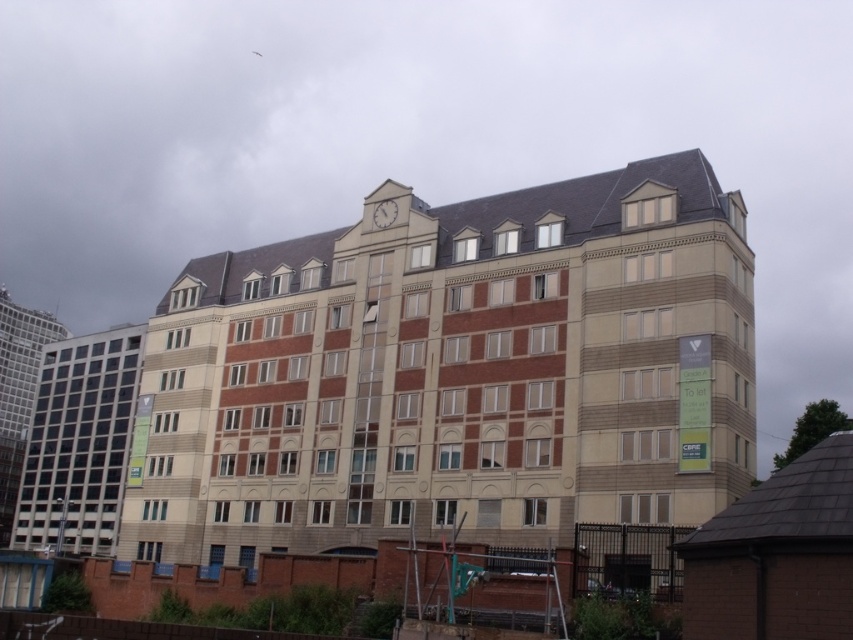
Is beige brick building at center in front of white stone clock at upper center?

Yes, beige brick building at center is in front of white stone clock at upper center.

Does point (704, 276) lie behind point (381, 227)?

No, it is not.

The width and height of the screenshot is (853, 640). Identify the location of beige brick building at center. (456, 372).

The height and width of the screenshot is (640, 853). Identify the location of beige brick building at center. (456, 372).

Does beige brick building at center have a larger size compared to matte glass building at left?

Indeed, beige brick building at center has a larger size compared to matte glass building at left.

Is point (323, 429) behind point (102, 476)?

No, (323, 429) is in front of (102, 476).

Is point (648, 438) positioned in front of point (94, 492)?

Yes, point (648, 438) is closer to viewer.

At what (x,y) coordinates should I click in order to perform the action: click on beige brick building at center. Please return your answer as a coordinate pair (x, y). Looking at the image, I should click on (456, 372).

Between brown brick building at lower right and white stone clock at upper center, which one appears on the right side from the viewer's perspective?

brown brick building at lower right is more to the right.

Which is behind, point (834, 460) or point (387, 209)?

Point (387, 209)

This screenshot has height=640, width=853. In order to click on brown brick building at lower right in this screenshot , I will do `click(776, 556)`.